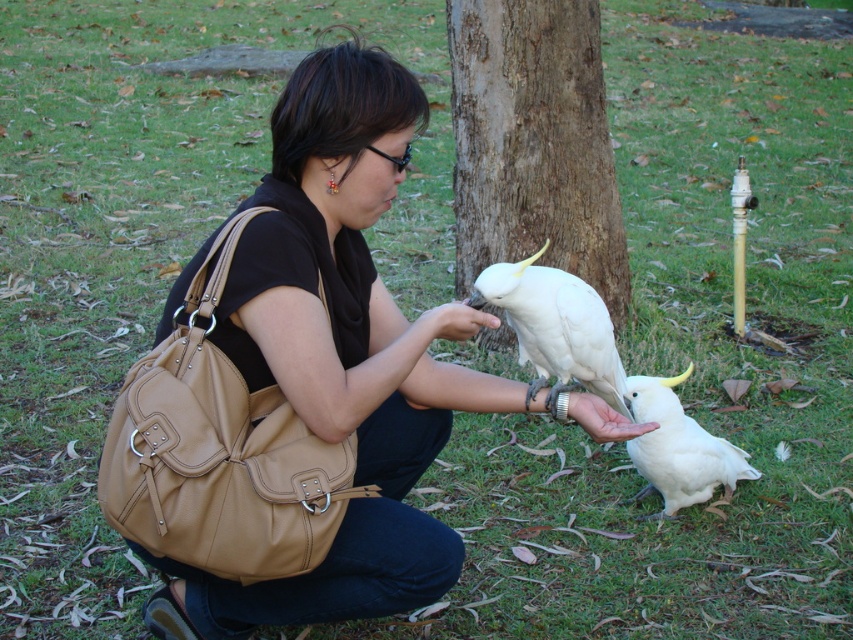
Question: Is matte brown bag at center positioned in front of brown rough tree trunk at center?

Choices:
 (A) yes
 (B) no

Answer: (A)

Question: Is white feathered parrot at center closer to camera compared to white matte parrot at lower right?

Choices:
 (A) yes
 (B) no

Answer: (A)

Question: Is matte brown bag at center thinner than brown rough tree trunk at center?

Choices:
 (A) no
 (B) yes

Answer: (A)

Question: Which point is farther to the camera?

Choices:
 (A) white feathered parrot at center
 (B) white matte parrot at lower right
 (C) matte brown bag at center

Answer: (B)

Question: Among these objects, which one is nearest to the camera?

Choices:
 (A) white feathered parrot at center
 (B) brown rough tree trunk at center
 (C) white matte parrot at lower right
 (D) matte brown bag at center

Answer: (D)

Question: Which point is farther from the camera taking this photo?

Choices:
 (A) (619, 259)
 (B) (630, 380)
 (C) (325, 212)
 (D) (540, 333)

Answer: (A)